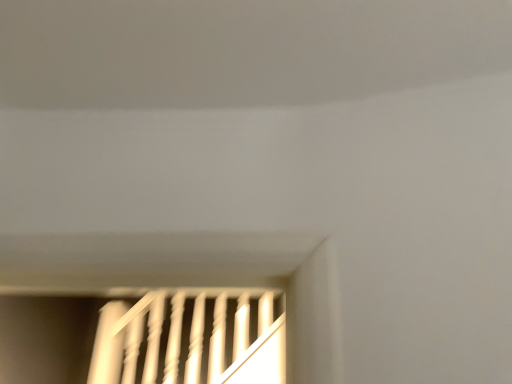
The width and height of the screenshot is (512, 384). What do you see at coordinates (191, 338) in the screenshot? I see `white glossy stairs at lower left` at bounding box center [191, 338].

Locate an element on the screen. white glossy stairs at lower left is located at coordinates [x=191, y=338].

At what (x,y) coordinates should I click in order to perform the action: click on white glossy stairs at lower left. Please return your answer as a coordinate pair (x, y). This screenshot has height=384, width=512. Looking at the image, I should click on (191, 338).